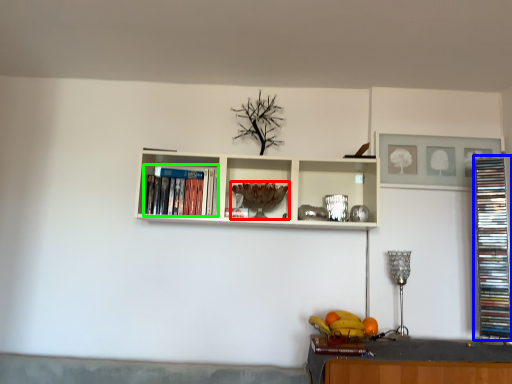
Question: Estimate the real-world distances between objects in this image. Which object is closer to wine glass (highlighted by a red box), book (highlighted by a blue box) or book (highlighted by a green box)?

Choices:
 (A) book
 (B) book

Answer: (B)